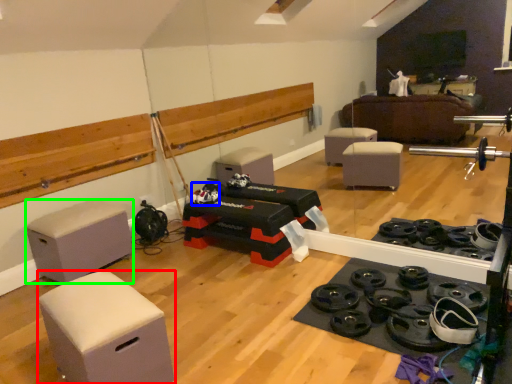
Question: Estimate the real-world distances between objects in this image. Which object is farther from furniture (highlighted by a red box), toy (highlighted by a blue box) or furniture (highlighted by a green box)?

Choices:
 (A) toy
 (B) furniture

Answer: (A)